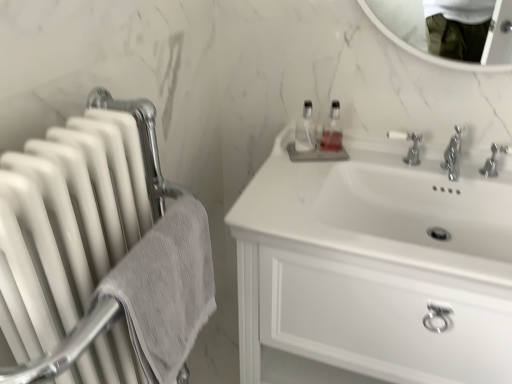
Question: Is white glossy cabinet at upper right taller than white glossy radiator at left?

Choices:
 (A) no
 (B) yes

Answer: (A)

Question: Is white glossy cabinet at upper right facing away from white glossy radiator at left?

Choices:
 (A) yes
 (B) no

Answer: (B)

Question: Considering the relative sizes of white glossy cabinet at upper right and white glossy radiator at left in the image provided, is white glossy cabinet at upper right smaller than white glossy radiator at left?

Choices:
 (A) no
 (B) yes

Answer: (A)

Question: From the image's perspective, is white glossy cabinet at upper right under white glossy radiator at left?

Choices:
 (A) no
 (B) yes

Answer: (B)

Question: Is white glossy cabinet at upper right facing towards white glossy radiator at left?

Choices:
 (A) yes
 (B) no

Answer: (A)

Question: Is white glossy radiator at left inside white glossy cabinet at upper right?

Choices:
 (A) no
 (B) yes

Answer: (A)

Question: Does translucent plastic soap dispenser at upper center appear on the left side of white glossy radiator at left?

Choices:
 (A) yes
 (B) no

Answer: (B)

Question: From a real-world perspective, is translucent plastic soap dispenser at upper center located beneath white glossy radiator at left?

Choices:
 (A) no
 (B) yes

Answer: (A)

Question: Can you confirm if translucent plastic soap dispenser at upper center is taller than white glossy radiator at left?

Choices:
 (A) no
 (B) yes

Answer: (A)

Question: From a real-world perspective, is translucent plastic soap dispenser at upper center on white glossy radiator at left?

Choices:
 (A) no
 (B) yes

Answer: (B)

Question: Can you confirm if translucent plastic soap dispenser at upper center is thinner than white glossy radiator at left?

Choices:
 (A) no
 (B) yes

Answer: (B)

Question: From the image's perspective, is translucent plastic soap dispenser at upper center on white glossy radiator at left?

Choices:
 (A) yes
 (B) no

Answer: (A)

Question: Is white glossy radiator at left oriented towards gray textured towel at left?

Choices:
 (A) no
 (B) yes

Answer: (B)